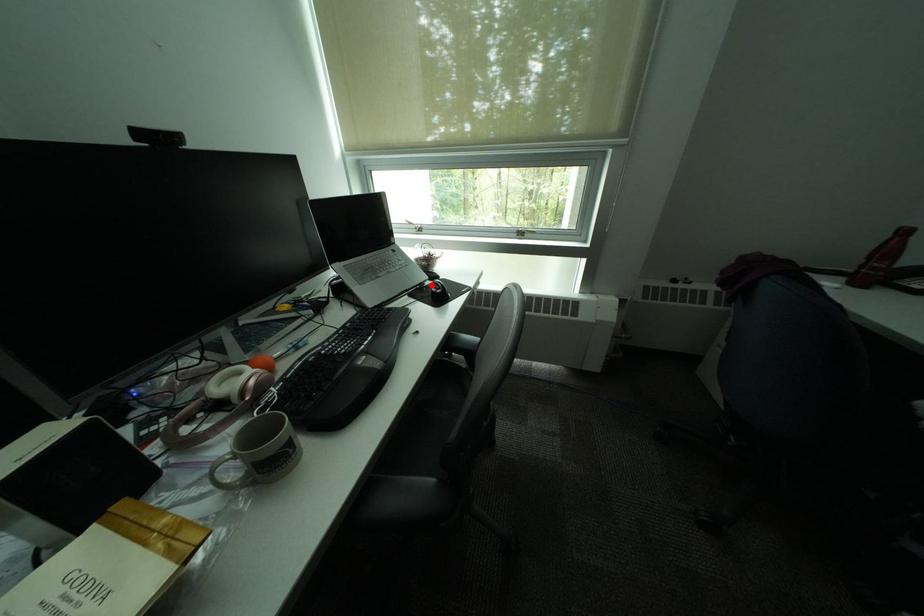
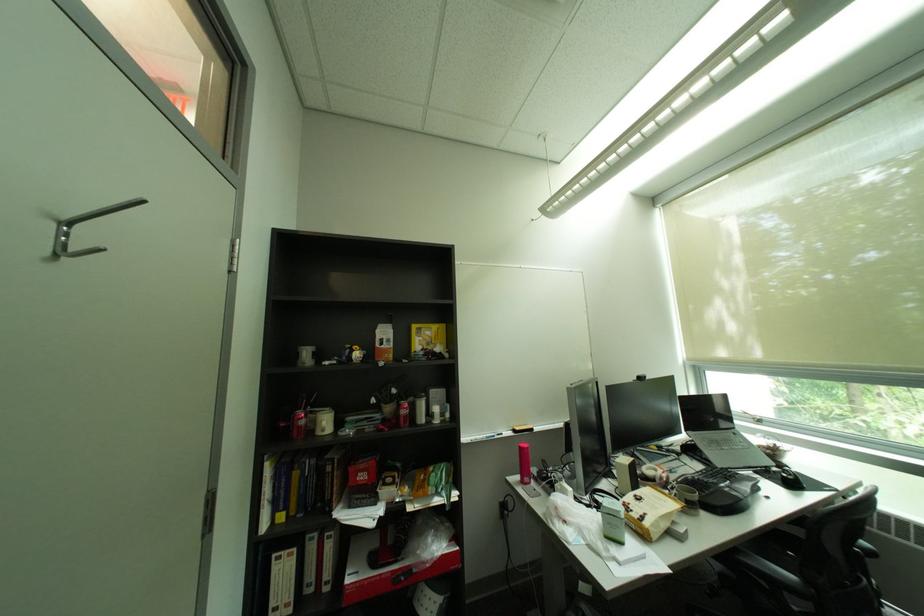
Where in the second image is the point corresponding to the highlighted location from the first image?

(777, 468)